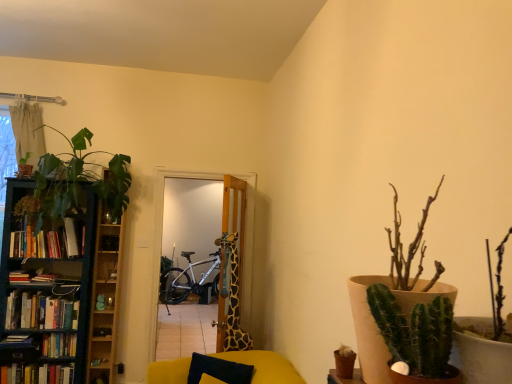
Question: From a real-world perspective, is green leafy plant at left, marked as the 2th houseplant in a back-to-front arrangement, positioned over green leafy plant at upper left, the 1th houseplant viewed from the back, based on gravity?

Choices:
 (A) no
 (B) yes

Answer: (A)

Question: Does green leafy plant at left, marked as the 2th houseplant in a back-to-front arrangement, lie in front of green leafy plant at upper left, the third houseplant when ordered from right to left?

Choices:
 (A) yes
 (B) no

Answer: (A)

Question: Does green leafy plant at left, the 2th houseplant from the front, have a lesser height compared to green leafy plant at upper left, the third houseplant when ordered from right to left?

Choices:
 (A) no
 (B) yes

Answer: (A)

Question: From a real-world perspective, is green leafy plant at left, which ranks as the 2th houseplant in left-to-right order, physically below green leafy plant at upper left, the third houseplant when ordered from right to left?

Choices:
 (A) no
 (B) yes

Answer: (B)

Question: Is green leafy plant at left, the 2th houseplant viewed from the right, oriented away from green leafy plant at upper left, the 1th houseplant viewed from the back?

Choices:
 (A) no
 (B) yes

Answer: (A)

Question: In the image, is green spiky cactus at right, the 1th houseplant when ordered from right to left, on the left side or the right side of giraffe-patterned door at center?

Choices:
 (A) right
 (B) left

Answer: (A)

Question: Is point tap(457, 327) closer or farther from the camera than point tap(232, 331)?

Choices:
 (A) farther
 (B) closer

Answer: (B)

Question: Looking at the image, does green spiky cactus at right, which appears as the 1th houseplant when viewed from the front, seem bigger or smaller compared to giraffe-patterned door at center?

Choices:
 (A) small
 (B) big

Answer: (A)

Question: Considering the positions of green spiky cactus at right, which ranks as the third houseplant in left-to-right order, and giraffe-patterned door at center in the image, is green spiky cactus at right, which ranks as the third houseplant in left-to-right order, wider or thinner than giraffe-patterned door at center?

Choices:
 (A) thin
 (B) wide

Answer: (A)

Question: Considering their positions, is green leafy plant at upper left, the 1th houseplant viewed from the back, located in front of or behind velvety dark blue pillow at lower center?

Choices:
 (A) behind
 (B) front

Answer: (A)

Question: From a real-world perspective, is green leafy plant at upper left, the 1th houseplant viewed from the back, positioned above or below velvety dark blue pillow at lower center?

Choices:
 (A) above
 (B) below

Answer: (A)

Question: Do you think green leafy plant at upper left, positioned as the 1th houseplant in left-to-right order, is within velvety dark blue pillow at lower center, or outside of it?

Choices:
 (A) outside
 (B) inside

Answer: (A)

Question: Is green leafy plant at upper left, positioned as the 1th houseplant in left-to-right order, wider or thinner than velvety dark blue pillow at lower center?

Choices:
 (A) wide
 (B) thin

Answer: (B)

Question: Based on their sizes in the image, would you say wooden cabinet at left is bigger or smaller than hardcover books at left, the 4th book positioned from the bottom?

Choices:
 (A) big
 (B) small

Answer: (A)

Question: Considering their positions, is wooden cabinet at left located in front of or behind hardcover books at left, the 4th book positioned from the bottom?

Choices:
 (A) front
 (B) behind

Answer: (B)